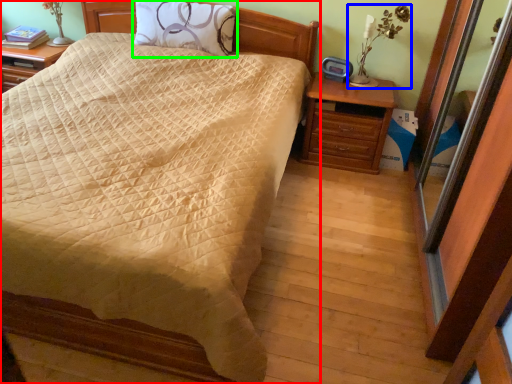
Question: Which object is the closest to the bed (highlighted by a red box)? Choose among these: table lamp (highlighted by a blue box) or pillow (highlighted by a green box).

Choices:
 (A) table lamp
 (B) pillow

Answer: (B)